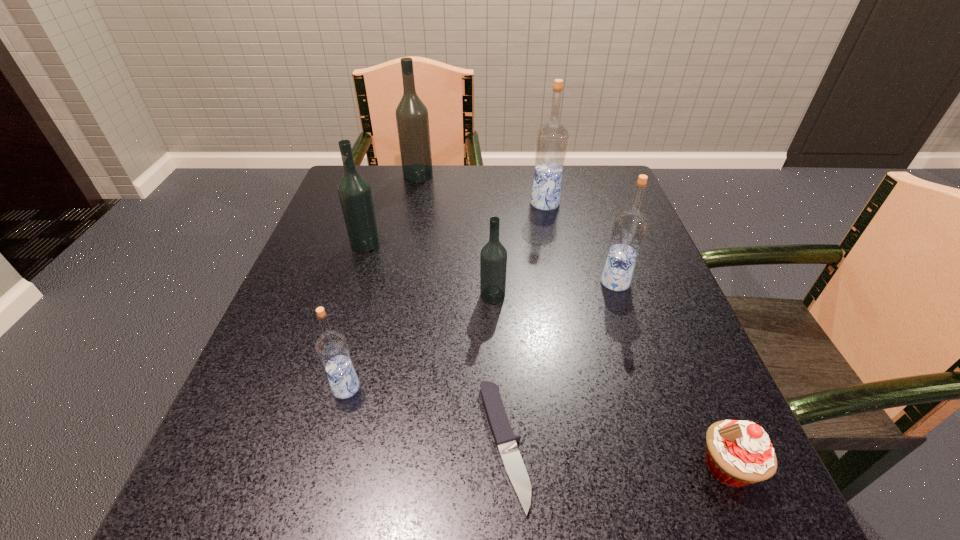
Identify the location of the smallest black vodka. Image resolution: width=960 pixels, height=540 pixels. (493, 258).

You are a GUI agent. You are given a task and a screenshot of the screen. Output one action in this format:
    pyautogui.click(x=<x>, y=<y>)
    Task: Click on the rightmost black vodka
    This screenshot has width=960, height=540.
    Given the screenshot: What is the action you would take?
    pyautogui.click(x=493, y=258)

You are a GUI agent. You are given a task and a screenshot of the screen. Output one action in this format:
    pyautogui.click(x=<x>, y=<y>)
    Task: Click on the pink cupcake
    
    Given the screenshot: What is the action you would take?
    pyautogui.click(x=738, y=453)

The width and height of the screenshot is (960, 540). I want to click on the seventh tallest object, so click(738, 453).

The image size is (960, 540). Find the location of `the shortest object`. the shortest object is located at coordinates (505, 440).

Where is `free space located 0.400m on the front of the farthest object`? This screenshot has width=960, height=540. free space located 0.400m on the front of the farthest object is located at coordinates (396, 284).

At what (x,y) coordinates should I click in order to perform the action: click on blank space located on the left of the biggest blue vodka. Please return your answer as a coordinate pair (x, y). Looking at the image, I should click on (439, 204).

At what (x,y) coordinates should I click in order to perform the action: click on free space located 0.270m on the front of the second smallest blue vodka. Please return your answer as a coordinate pair (x, y). Looking at the image, I should click on (660, 416).

Identify the location of vacant space positioned on the front of the fourth nearest vodka. (329, 360).

The width and height of the screenshot is (960, 540). What are the coordinates of `free space located on the back of the smallest blue vodka` in the screenshot? It's located at (375, 278).